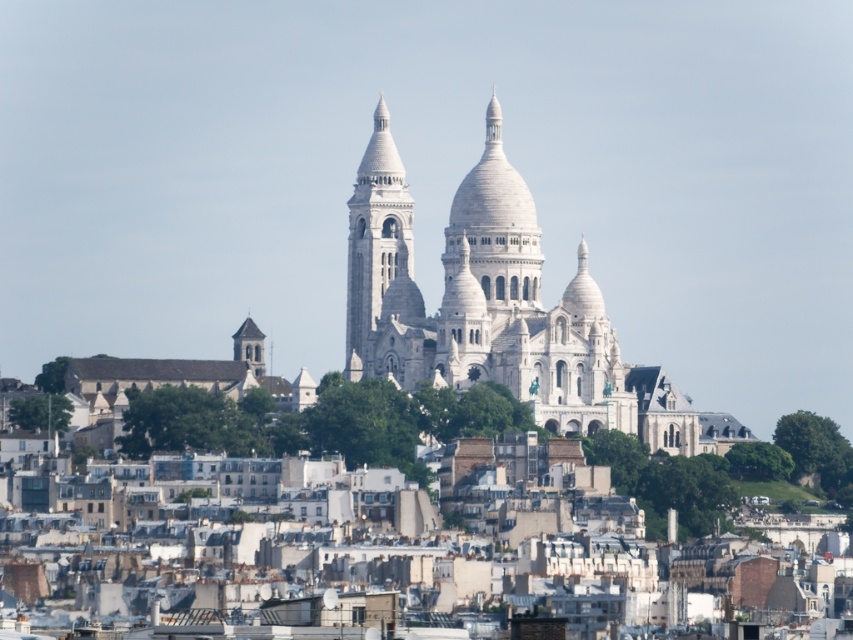
Does point (425, 317) come in front of point (250, 330)?

That is True.

Can you confirm if white stone tower at center is positioned to the right of smooth gray stone tower at lower left?

Yes, white stone tower at center is to the right of smooth gray stone tower at lower left.

The width and height of the screenshot is (853, 640). Find the location of `white stone tower at center`. white stone tower at center is located at coordinates (383, 269).